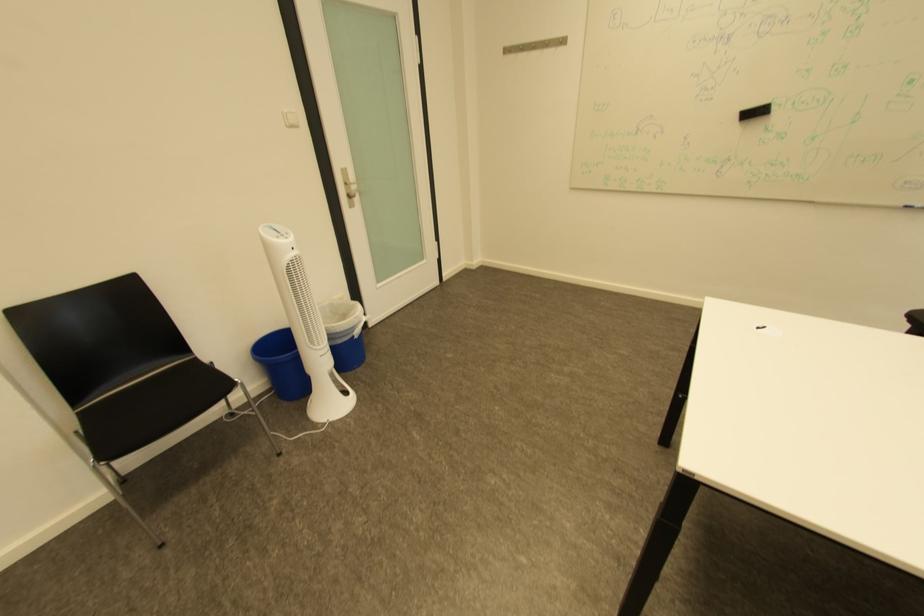
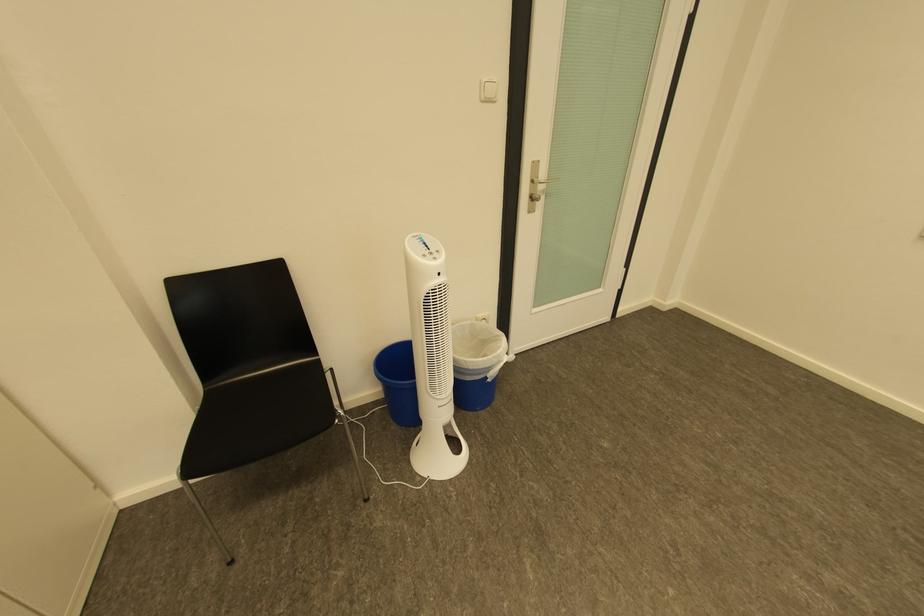
Where in the second image is the point corresponding to pixel 297 127 from the first image?

(492, 99)